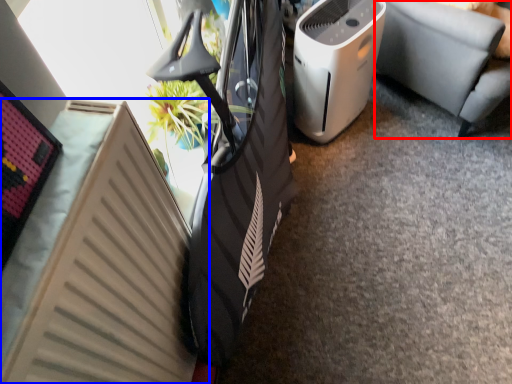
Question: Which point is closer to the camera, furniture (highlighted by a red box) or radiator (highlighted by a blue box)?

Choices:
 (A) furniture
 (B) radiator

Answer: (B)